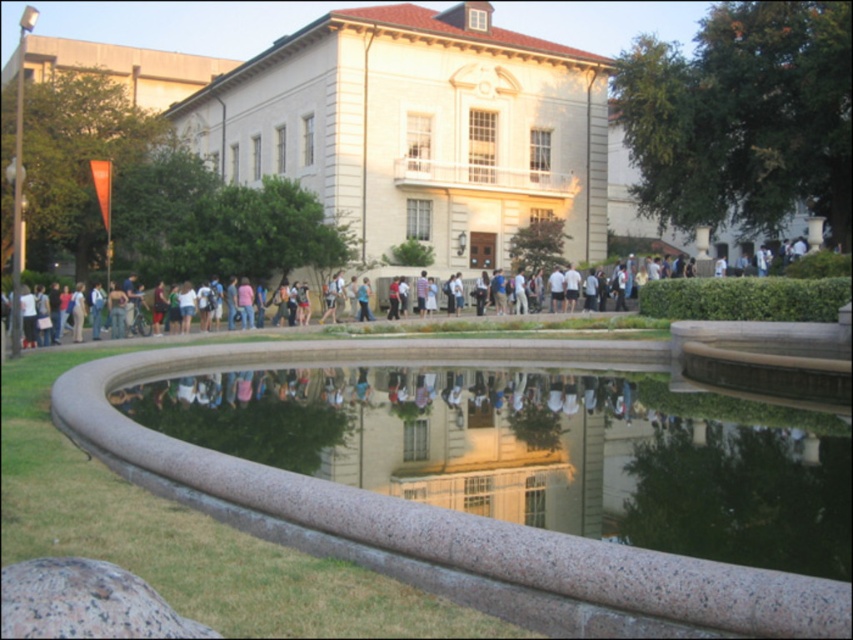
Question: Can you confirm if white stone building at center is positioned to the left of granite fountain at lower center?

Choices:
 (A) no
 (B) yes

Answer: (B)

Question: Which point is farther to the camera?

Choices:
 (A) granite fountain at lower center
 (B) white stone building at center

Answer: (B)

Question: Does white stone building at center appear on the right side of granite fountain at lower center?

Choices:
 (A) yes
 (B) no

Answer: (B)

Question: Does white stone building at center have a lesser width compared to granite fountain at lower center?

Choices:
 (A) yes
 (B) no

Answer: (B)